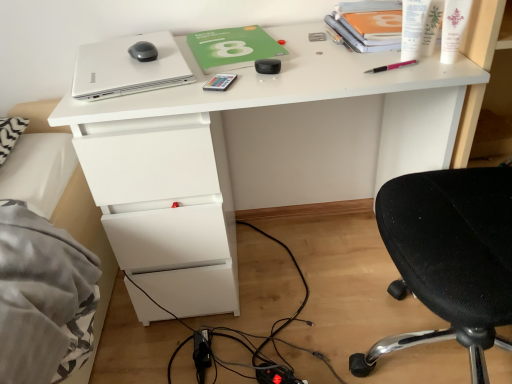
This screenshot has width=512, height=384. Describe the element at coordinates (390, 66) in the screenshot. I see `pink plastic pen at upper right, placed as the 3th stationery when sorted from right to left` at that location.

The image size is (512, 384). Describe the element at coordinates (227, 155) in the screenshot. I see `white glossy desk at center` at that location.

Measure the distance between white glossy desk at center and camera.

The distance of white glossy desk at center from camera is 33.84 inches.

You are a GUI agent. You are given a task and a screenshot of the screen. Output one action in this format:
    pyautogui.click(x=<x>, y=<y>)
    Task: Click on the pink plastic pen at upper right, the second stationery in the left-to-right sequence
    
    Given the screenshot: What is the action you would take?
    pyautogui.click(x=390, y=66)

From a real-world perspective, who is located higher, matte black mouse at upper left or white plastic pen at upper right, the 2th stationery from the right?

white plastic pen at upper right, the 2th stationery from the right, from a real-world perspective.

Considering the relative positions of matte black mouse at upper left and white plastic pen at upper right, the 2th stationery from the right, in the image provided, is matte black mouse at upper left to the left of white plastic pen at upper right, the 2th stationery from the right, from the viewer's perspective?

Correct, you'll find matte black mouse at upper left to the left of white plastic pen at upper right, the 2th stationery from the right.

The image size is (512, 384). I want to click on mouse that appears below the white plastic pen at upper right, the 2th stationery from the right (from the image's perspective), so click(x=143, y=51).

Which is in front, point (143, 49) or point (428, 0)?

Point (428, 0)

From the image's perspective, is white plastic pen at upper right, the 2th stationery from the right, positioned above or below silver metallic laptop at upper left?

white plastic pen at upper right, the 2th stationery from the right, is above silver metallic laptop at upper left.

Considering the relative sizes of white plastic pen at upper right, the 3th stationery when ordered from left to right, and silver metallic laptop at upper left in the image provided, is white plastic pen at upper right, the 3th stationery when ordered from left to right, thinner than silver metallic laptop at upper left?

Yes, white plastic pen at upper right, the 3th stationery when ordered from left to right, is thinner than silver metallic laptop at upper left.

Is white plastic pen at upper right, the 3th stationery when ordered from left to right, aimed at silver metallic laptop at upper left?

No, white plastic pen at upper right, the 3th stationery when ordered from left to right, is not oriented towards silver metallic laptop at upper left.

From a real-world perspective, between white plastic pen at upper right, the 2th stationery from the right, and silver metallic laptop at upper left, who is vertically lower?

In real-world perspective, silver metallic laptop at upper left is lower.

Which object is thinner, silver metallic laptop at upper left or metallic rectangular object at center, which is the fourth stationery in right-to-left order?

Thinner between the two is metallic rectangular object at center, which is the fourth stationery in right-to-left order.

Visually, is silver metallic laptop at upper left positioned to the left or to the right of metallic rectangular object at center, the 1th stationery in the left-to-right sequence?

In the image, silver metallic laptop at upper left appears on the left side of metallic rectangular object at center, the 1th stationery in the left-to-right sequence.

From a real-world perspective, count 2nd stationerys downward from the silver metallic laptop at upper left and point to it. Please provide its 2D coordinates.

[(220, 82)]

From the image's perspective, is pink plastic pen at upper right, the second stationery in the left-to-right sequence, beneath white glossy cream at upper right?

Correct, pink plastic pen at upper right, the second stationery in the left-to-right sequence, appears lower than white glossy cream at upper right in the image.

Is pink plastic pen at upper right, the second stationery in the left-to-right sequence, far from white glossy cream at upper right?

No, there isn't a large distance between pink plastic pen at upper right, the second stationery in the left-to-right sequence, and white glossy cream at upper right.

Which object is further away from the camera, pink plastic pen at upper right, placed as the 3th stationery when sorted from right to left, or white glossy cream at upper right?

Positioned behind is pink plastic pen at upper right, placed as the 3th stationery when sorted from right to left.

Considering the relative sizes of pink plastic pen at upper right, the second stationery in the left-to-right sequence, and white glossy cream at upper right in the image provided, is pink plastic pen at upper right, the second stationery in the left-to-right sequence, wider than white glossy cream at upper right?

No, pink plastic pen at upper right, the second stationery in the left-to-right sequence, is not wider than white glossy cream at upper right.

Considering the relative sizes of silver metallic laptop at upper left and white paper towel at upper right, positioned as the fourth stationery in left-to-right order, in the image provided, is silver metallic laptop at upper left bigger than white paper towel at upper right, positioned as the fourth stationery in left-to-right order,?

Correct, silver metallic laptop at upper left is larger in size than white paper towel at upper right, positioned as the fourth stationery in left-to-right order.

Considering their positions, is silver metallic laptop at upper left located in front of or behind white paper towel at upper right, positioned as the fourth stationery in left-to-right order?

In the image, silver metallic laptop at upper left appears behind white paper towel at upper right, positioned as the fourth stationery in left-to-right order.

How many degrees apart are the facing directions of silver metallic laptop at upper left and white paper towel at upper right, positioned as the fourth stationery in left-to-right order?

The facing directions of silver metallic laptop at upper left and white paper towel at upper right, positioned as the fourth stationery in left-to-right order, are 43 degrees apart.

I want to click on toiletry below the white paper towel at upper right, which appears as the first stationery when viewed from the right (from a real-world perspective), so [x=453, y=28].

Which is in front, point (456, 28) or point (439, 17)?

The point (456, 28) is more forward.

Does white glossy cream at upper right have a larger size compared to white paper towel at upper right, which appears as the first stationery when viewed from the right?

Indeed, white glossy cream at upper right has a larger size compared to white paper towel at upper right, which appears as the first stationery when viewed from the right.

From a real-world perspective, is white glossy desk at center physically located above or below silver metallic laptop at upper left?

From a real-world perspective, white glossy desk at center is physically below silver metallic laptop at upper left.

Which of these two, white glossy desk at center or silver metallic laptop at upper left, is smaller?

With smaller size is silver metallic laptop at upper left.

Identify the location of desk located underneath the silver metallic laptop at upper left (from a real-world perspective). (227, 155).

Are white glossy desk at center and silver metallic laptop at upper left beside each other?

No.

Where is `stationery that is the 1st one above the matte black mouse at upper left (from a real-world perspective)`? stationery that is the 1st one above the matte black mouse at upper left (from a real-world perspective) is located at coordinates (413, 27).

What are the coordinates of `the 2nd stationery in front of the silver metallic laptop at upper left, counting from the anchor's position` in the screenshot? It's located at (413, 27).

From the image, which object appears to be nearer to white plastic pen at upper right, the 2th stationery from the right, white glossy cream at upper right or metallic rectangular object at center, the 1th stationery in the left-to-right sequence?

The object closer to white plastic pen at upper right, the 2th stationery from the right, is white glossy cream at upper right.

Looking at the image, which one is located further to matte black mouse at upper left, metallic rectangular object at center, the 1th stationery in the left-to-right sequence, or white glossy cream at upper right?

Based on the image, white glossy cream at upper right appears to be further to matte black mouse at upper left.

Looking at the image, which one is located closer to white paper towel at upper right, which appears as the first stationery when viewed from the right, white glossy cream at upper right or white glossy desk at center?

white glossy cream at upper right.

Based on their spatial positions, is green matte notebook at center or white paper towel at upper right, which appears as the first stationery when viewed from the right, closer to white glossy cream at upper right?

white paper towel at upper right, which appears as the first stationery when viewed from the right.

Estimate the real-world distances between objects in this image. Which object is further from white glossy desk at center, silver metallic laptop at upper left or green matte notebook at center?

The object further to white glossy desk at center is silver metallic laptop at upper left.

Based on their spatial positions, is green matte notebook at center or white glossy desk at center further from matte black mouse at upper left?

white glossy desk at center lies further to matte black mouse at upper left than the other object.

From the image, which object appears to be farther from white paper towel at upper right, positioned as the fourth stationery in left-to-right order, pink plastic pen at upper right, the second stationery in the left-to-right sequence, or white glossy desk at center?

white glossy desk at center.

When comparing their distances from pink plastic pen at upper right, the second stationery in the left-to-right sequence, does white glossy desk at center or green matte notebook at center seem further?

white glossy desk at center lies further to pink plastic pen at upper right, the second stationery in the left-to-right sequence, than the other object.

Where is `laptop between green matte notebook at center and white glossy desk at center in the up-down direction`? Image resolution: width=512 pixels, height=384 pixels. laptop between green matte notebook at center and white glossy desk at center in the up-down direction is located at coordinates (129, 67).

Image resolution: width=512 pixels, height=384 pixels. What are the coordinates of `stationery between green matte notebook at center and white plastic pen at upper right, the 3th stationery when ordered from left to right, in the horizontal direction` in the screenshot? It's located at click(390, 66).

Find the location of `desk between matte black mouse at upper left and white glossy cream at upper right in the horizontal direction`. desk between matte black mouse at upper left and white glossy cream at upper right in the horizontal direction is located at coordinates 227,155.

Where is `notebook situated between metallic rectangular object at center, which is the fourth stationery in right-to-left order, and pink plastic pen at upper right, the second stationery in the left-to-right sequence, from left to right`? The height and width of the screenshot is (384, 512). notebook situated between metallic rectangular object at center, which is the fourth stationery in right-to-left order, and pink plastic pen at upper right, the second stationery in the left-to-right sequence, from left to right is located at coordinates (232, 48).